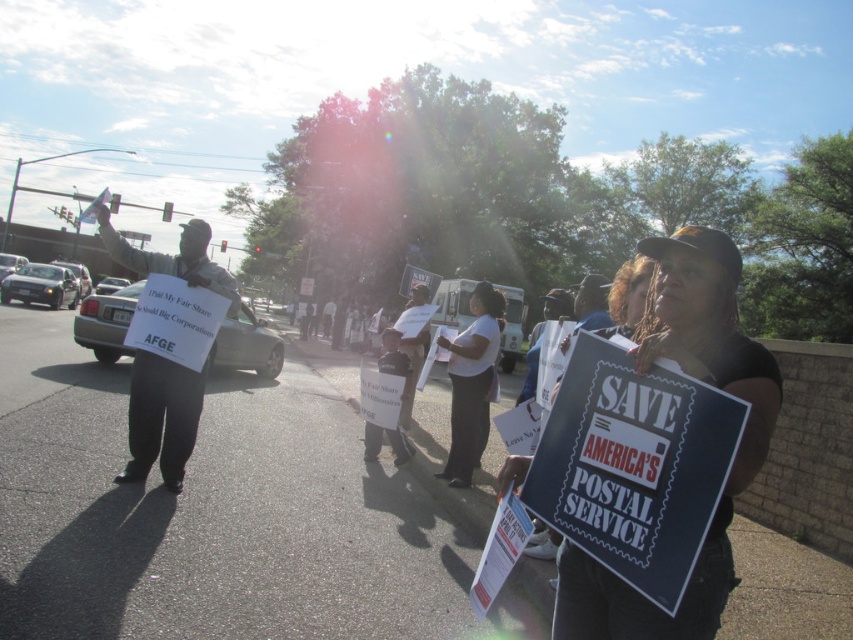
Question: Does black fabric sign at center appear on the left side of white cotton shirt at center?

Choices:
 (A) yes
 (B) no

Answer: (B)

Question: Does black fabric sign at center lie in front of white cotton shirt at center?

Choices:
 (A) no
 (B) yes

Answer: (B)

Question: Which object appears farthest from the camera in this image?

Choices:
 (A) white cotton shirt at center
 (B) black fabric sign at center

Answer: (A)

Question: Which of the following is the farthest from the observer?

Choices:
 (A) (737, 465)
 (B) (457, 336)

Answer: (B)

Question: Which point appears farthest from the camera in this image?

Choices:
 (A) (730, 385)
 (B) (500, 301)

Answer: (B)

Question: Is black fabric sign at center thinner than white cotton shirt at center?

Choices:
 (A) no
 (B) yes

Answer: (B)